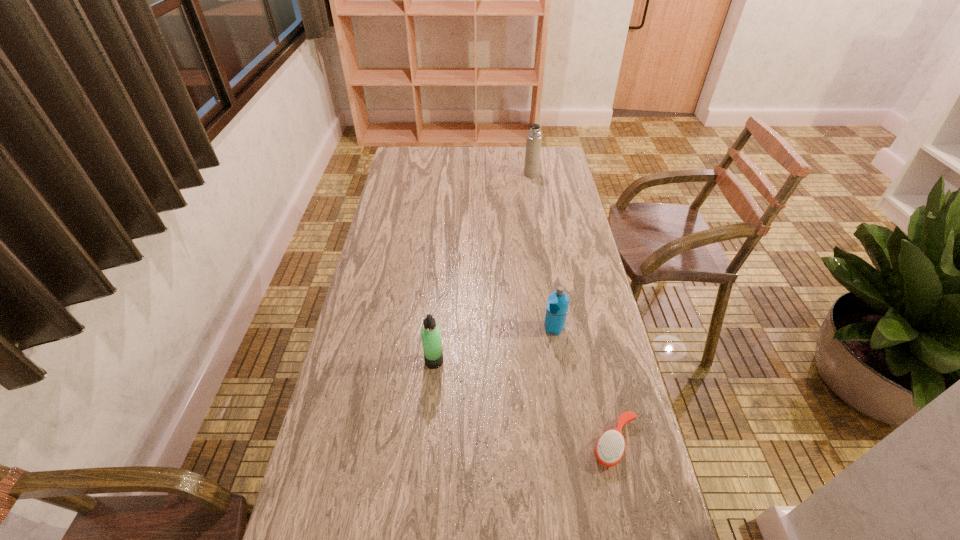
The image size is (960, 540). Identify the location of blank area located on the left of the nearest object. (462, 442).

Image resolution: width=960 pixels, height=540 pixels. I want to click on object that is at the far edge, so (x=534, y=138).

Locate an element on the screen. The width and height of the screenshot is (960, 540). hairbrush present at the right edge is located at coordinates (610, 447).

I want to click on object present at the far right corner, so click(534, 138).

In the image, there is a desktop. Where is `vacant space at the far edge`? This screenshot has height=540, width=960. vacant space at the far edge is located at coordinates (524, 156).

Identify the location of free space at the left edge. (371, 267).

Locate an element on the screen. The width and height of the screenshot is (960, 540). vacant space at the right edge is located at coordinates (567, 232).

The image size is (960, 540). I want to click on vacant point located between the leftmost object and the hairbrush, so click(525, 402).

Where is `free space that is in between the second nearest object and the tallest thermos bottle`? The image size is (960, 540). free space that is in between the second nearest object and the tallest thermos bottle is located at coordinates (483, 267).

Where is `empty space between the farthest object and the second farthest object`? The height and width of the screenshot is (540, 960). empty space between the farthest object and the second farthest object is located at coordinates (542, 251).